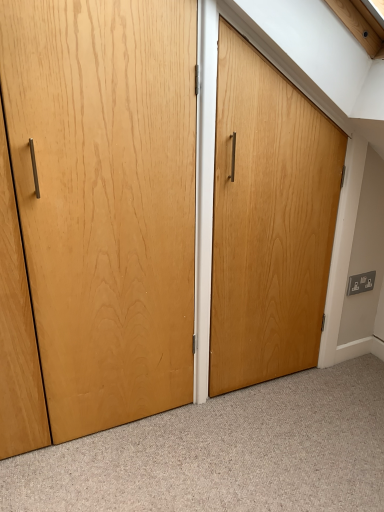
Describe the element at coordinates (105, 200) in the screenshot. I see `natural wood door at center` at that location.

You are a GUI agent. You are given a task and a screenshot of the screen. Output one action in this format:
    pyautogui.click(x=<x>, y=<y>)
    Task: Click on the natural wood door at center
    The height and width of the screenshot is (512, 384).
    Given the screenshot: What is the action you would take?
    pyautogui.click(x=105, y=200)

What do you see at coordinates (361, 283) in the screenshot?
I see `satin silver outlet at right` at bounding box center [361, 283].

Locate an element on the screen. The width and height of the screenshot is (384, 512). satin silver outlet at right is located at coordinates (361, 283).

Where is `natural wood door at center`? natural wood door at center is located at coordinates (105, 200).

Between satin silver outlet at right and natural wood door at center, which one appears on the left side from the viewer's perspective?

Positioned to the left is natural wood door at center.

Which object is closer to the camera taking this photo, satin silver outlet at right or natural wood door at center?

Positioned in front is natural wood door at center.

Is point (356, 283) more distant than point (81, 430)?

Yes, point (356, 283) is farther from viewer.

From the image's perspective, is satin silver outlet at right over natural wood door at center?

Incorrect, from the image's perspective, satin silver outlet at right is lower than natural wood door at center.

From a real-world perspective, between satin silver outlet at right and natural wood door at center, who is vertically lower?

satin silver outlet at right, from a real-world perspective.

Can you confirm if satin silver outlet at right is thinner than natural wood door at center?

In fact, satin silver outlet at right might be wider than natural wood door at center.

Is satin silver outlet at right shorter than natural wood door at center?

Yes, satin silver outlet at right is shorter than natural wood door at center.

Between satin silver outlet at right and natural wood door at center, which one has smaller size?

With smaller size is satin silver outlet at right.

Does satin silver outlet at right contain natural wood door at center?

No, satin silver outlet at right does not contain natural wood door at center.

Is satin silver outlet at right placed right next to natural wood door at center?

No, satin silver outlet at right is not making contact with natural wood door at center.

Is satin silver outlet at right facing towards natural wood door at center?

No, satin silver outlet at right is not turned towards natural wood door at center.

How far apart are satin silver outlet at right and natural wood door at center?

satin silver outlet at right is 3.60 feet away from natural wood door at center.

This screenshot has height=512, width=384. I want to click on electric outlet to the right of natural wood door at center, so tap(361, 283).

Which object is positioned more to the left, natural wood door at center or satin silver outlet at right?

Positioned to the left is natural wood door at center.

Considering their positions, is natural wood door at center located in front of or behind satin silver outlet at right?

natural wood door at center is positioned closer to the viewer than satin silver outlet at right.

Which is in front, point (33, 112) or point (360, 292)?

Positioned in front is point (33, 112).

Consider the image. From the image's perspective, between natural wood door at center and satin silver outlet at right, which one is located above?

natural wood door at center.

From a real-world perspective, which object rests below the other?

satin silver outlet at right, from a real-world perspective.

In terms of width, does natural wood door at center look wider or thinner when compared to satin silver outlet at right?

In the image, natural wood door at center appears to be more narrow than satin silver outlet at right.

Considering the sizes of objects natural wood door at center and satin silver outlet at right in the image provided, who is taller, natural wood door at center or satin silver outlet at right?

With more height is natural wood door at center.

Between natural wood door at center and satin silver outlet at right, which one has smaller size?

Smaller between the two is satin silver outlet at right.

Is satin silver outlet at right inside natural wood door at center?

Definitely not — satin silver outlet at right is not inside natural wood door at center.

Is natural wood door at center next to satin silver outlet at right and touching it?

No.

Does natural wood door at center turn towards satin silver outlet at right?

No, natural wood door at center is not aimed at satin silver outlet at right.

This screenshot has width=384, height=512. In order to click on door above the satin silver outlet at right (from the image's perspective) in this screenshot , I will do `click(105, 200)`.

At what (x,y) coordinates should I click in order to perform the action: click on electric outlet below the natural wood door at center (from a real-world perspective). Please return your answer as a coordinate pair (x, y). This screenshot has height=512, width=384. Looking at the image, I should click on click(x=361, y=283).

Find the location of a particular element. door that is above the satin silver outlet at right (from a real-world perspective) is located at coordinates (105, 200).